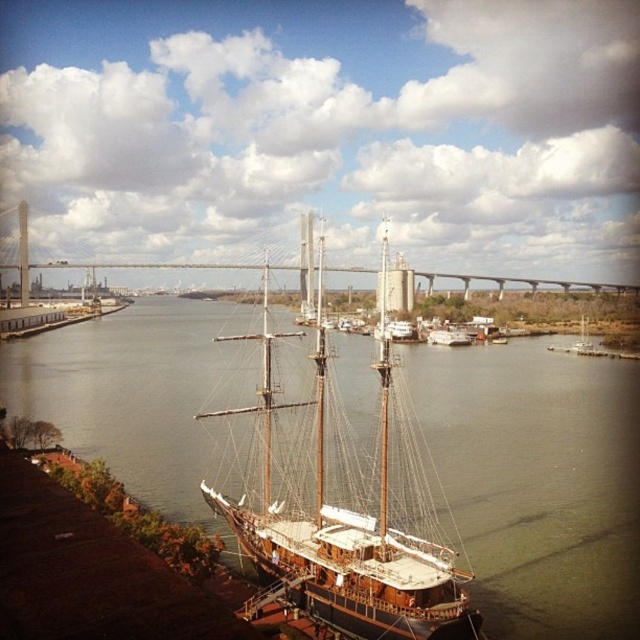
The height and width of the screenshot is (640, 640). What do you see at coordinates (84, 260) in the screenshot?
I see `concrete bridge at center` at bounding box center [84, 260].

Between concrete bridge at center and wooden ship at center, which one appears on the right side from the viewer's perspective?

Positioned to the right is wooden ship at center.

Between point (330, 268) and point (429, 340), which one is positioned in front?

Point (429, 340) is more forward.

The image size is (640, 640). Identify the location of concrete bridge at center. (84, 260).

Between wooden sailboat at center and concrete bridge at center, which one has more height?

wooden sailboat at center

Is point (376, 556) farther from camera compared to point (90, 260)?

No.

Locate an element on the screen. The image size is (640, 640). wooden sailboat at center is located at coordinates (344, 522).

I want to click on wooden sailboat at center, so click(344, 522).

Is point (496, 541) less distant than point (266, 266)?

That is True.

Based on the photo, is brown wooden ship at center closer to camera compared to wooden sailboat at center?

No, brown wooden ship at center is further to the viewer.

Who is more forward, (504, 365) or (269, 353)?

Point (269, 353) is in front.

At what (x,y) coordinates should I click in order to perform the action: click on brown wooden ship at center. Please return your answer as a coordinate pair (x, y). The image size is (640, 640). Looking at the image, I should click on (540, 483).